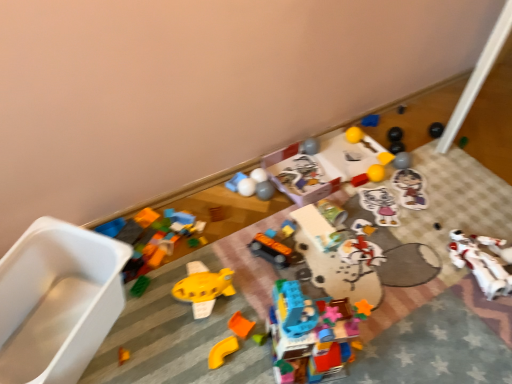
Locate an element on the screen. This screenshot has width=512, height=384. vacant space in between matte plastic sticker at center, positioned as the 16th toy in left-to-right order, and yellow matte toy boat at center, positioned as the second toy in left-to-right order is located at coordinates (325, 237).